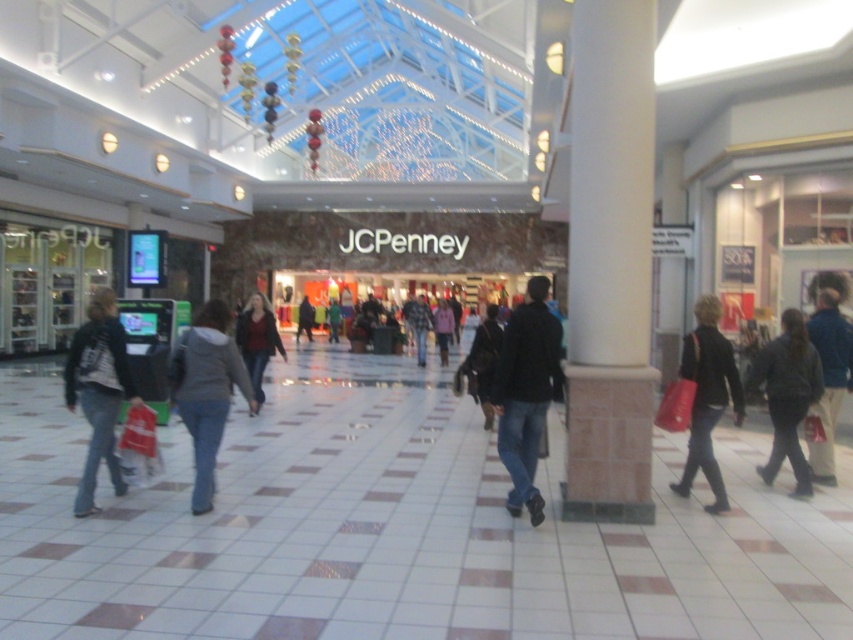
Question: Among these points, which one is farthest from the camera?

Choices:
 (A) (714, 442)
 (B) (311, 330)
 (C) (421, 346)

Answer: (B)

Question: Can you confirm if dark gray jacket at right is smaller than green fabric jacket at center?

Choices:
 (A) yes
 (B) no

Answer: (B)

Question: Can you confirm if white concrete pillar at center is smaller than pink fabric jacket at center?

Choices:
 (A) yes
 (B) no

Answer: (B)

Question: Which object is farther from the camera taking this photo?

Choices:
 (A) dark blue jeans at center
 (B) gray fleece jacket at center
 (C) white concrete pillar at center

Answer: (A)

Question: Is brown leather jacket at lower right positioned in front of camouflage jacket at center?

Choices:
 (A) yes
 (B) no

Answer: (A)

Question: Among these points, which one is nearest to the camera?

Choices:
 (A) (421, 316)
 (B) (260, 323)
 (C) (695, 404)

Answer: (C)